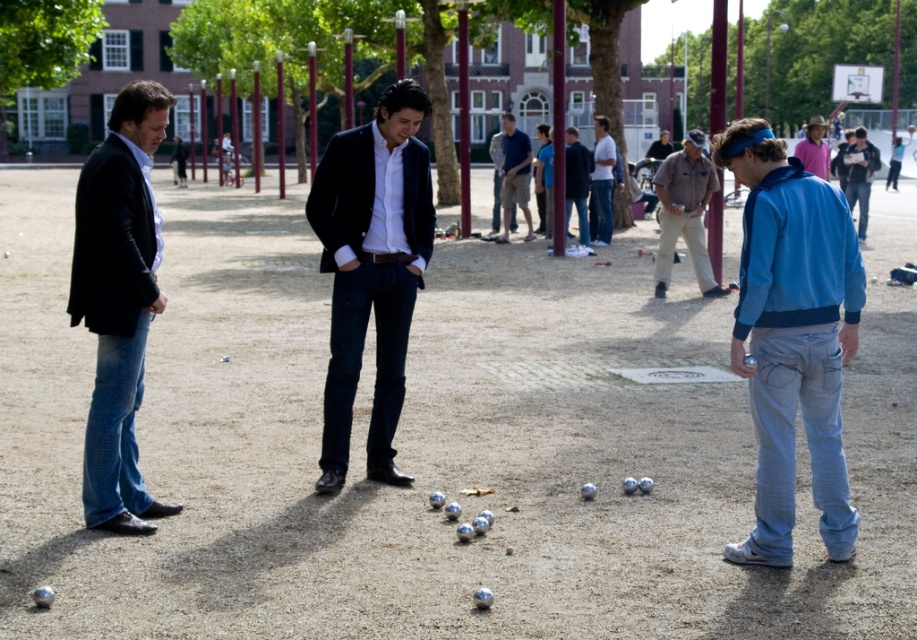
In the scene of three men playing petanque, the khaki cotton pants at center and dark blue shirt at center are both worn by the central figure. Which item is positioned to the right side of the other?

The khaki cotton pants at center is to the right of dark blue shirt at center.

You are a photographer standing 10 meters away from the scene. You want to take a photo of the khaki cotton pants at center and the dark blue shirt at center such that both are in focus. Given that your camera has a depth of field that can cover 5 meters, will you be able to capture both objects clearly in the same shot?

The khaki cotton pants at center is 7.62 meters from dark blue shirt at center. Since the distance between them exceeds the camera depth of field of 5 meters, you cannot capture both clearly in the same shot.

You are a photographer positioned at the origin point of the image. You need to take a photo that includes both the blue fleece jacket at right and the central figure. Given their coordinates, what is the best direction to aim your camera?

The blue fleece jacket at right is located at coordinates point (792, 337). To include both the blue fleece jacket at right and the central figure in the photo, aim the camera towards the central area between their positions.